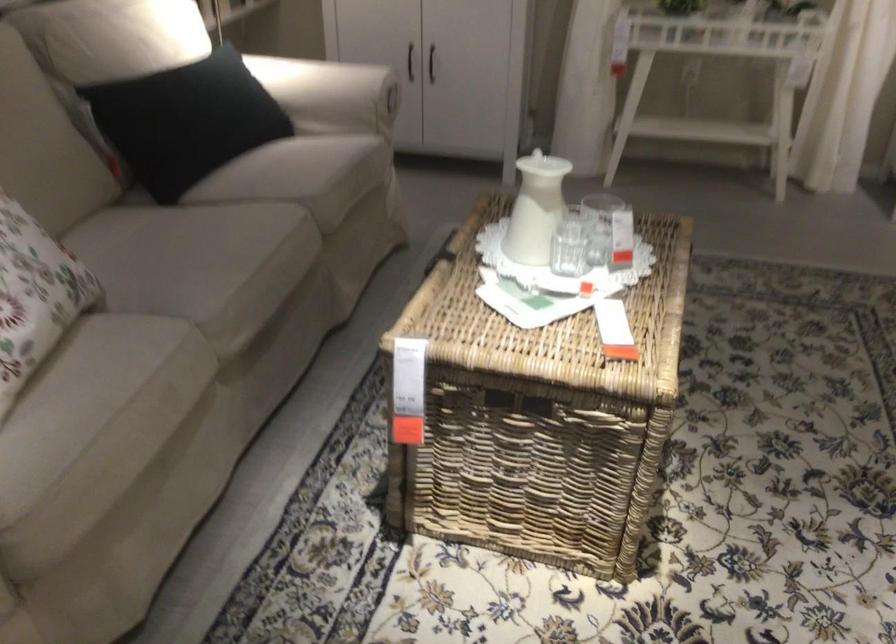
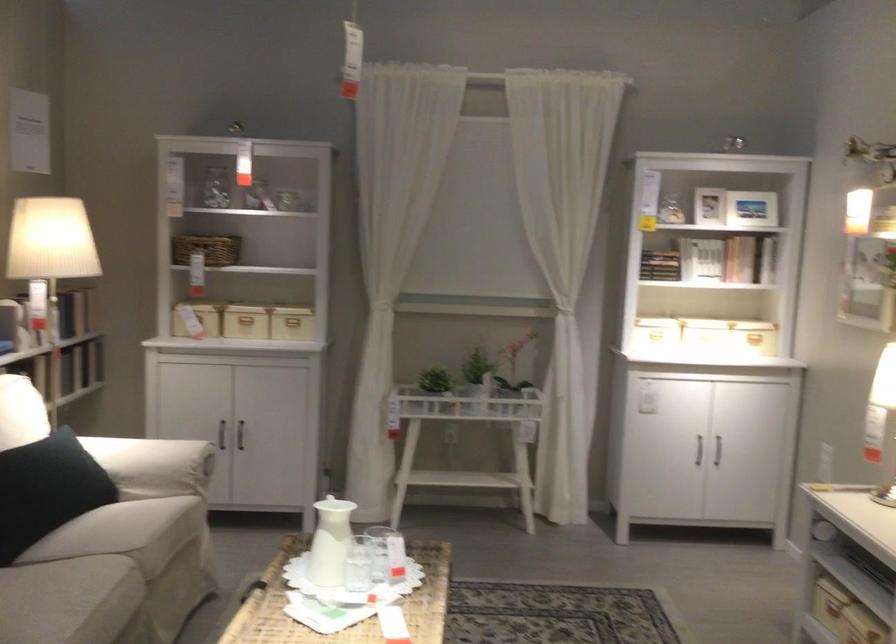
Locate, in the second image, the point that corresponds to point (562, 230) in the first image.

(358, 564)